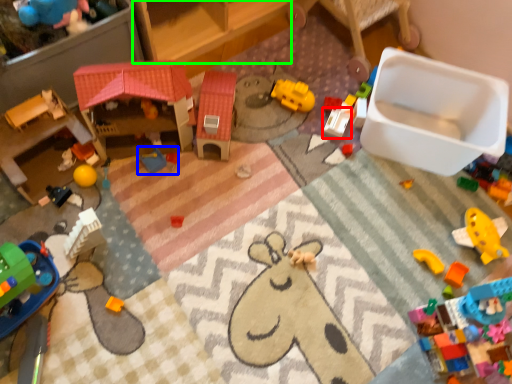
Question: Considering the real-world distances, which object is farthest from toy (highlighted by a red box)? toy (highlighted by a blue box) or furniture (highlighted by a green box)?

Choices:
 (A) toy
 (B) furniture

Answer: (A)